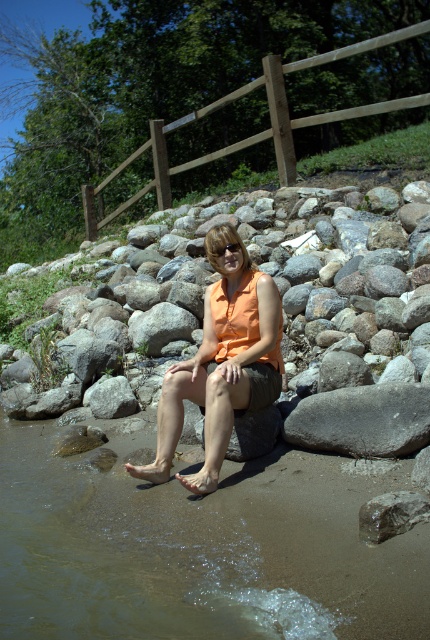
You are standing at the edge of the water and want to place a small item between the gray smooth rock at lower right and the smooth gray rock at lower right. Which rock should you move closer to you to create space?

You should move the gray smooth rock at lower right closer to you because it is already closer than the smooth gray rock at lower right, so moving it further towards you would create space between them.

You are a hiker who wants to cross the water using the rocks. You have a backpack that is 1.2 meters wide. Can you fit your backpack between the gray smooth rock at lower right and the smooth gray rock at lower right?

The gray smooth rock at lower right might be wider than smooth gray rock at lower right, but since the exact width difference isn not specified, it is uncertain if the 1.2 meter backpack will fit between them. You should check the actual distance before attempting to cross.

Looking at this image, you are a photographer standing at the edge of the water. You want to take a photo of the orange fabric shirt at center and the gray smooth rock at lower right. Which object is closer to you, the photographer?

The orange fabric shirt at center is closer to you because it is further to the viewer than the gray smooth rock at lower right.